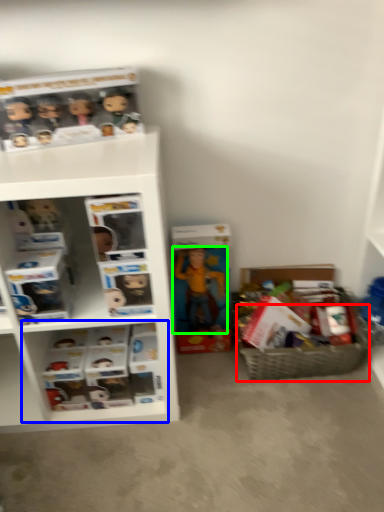
Question: Which is farther away from basket (highlighted by a red box)? cabinet (highlighted by a blue box) or toy (highlighted by a green box)?

Choices:
 (A) cabinet
 (B) toy

Answer: (A)